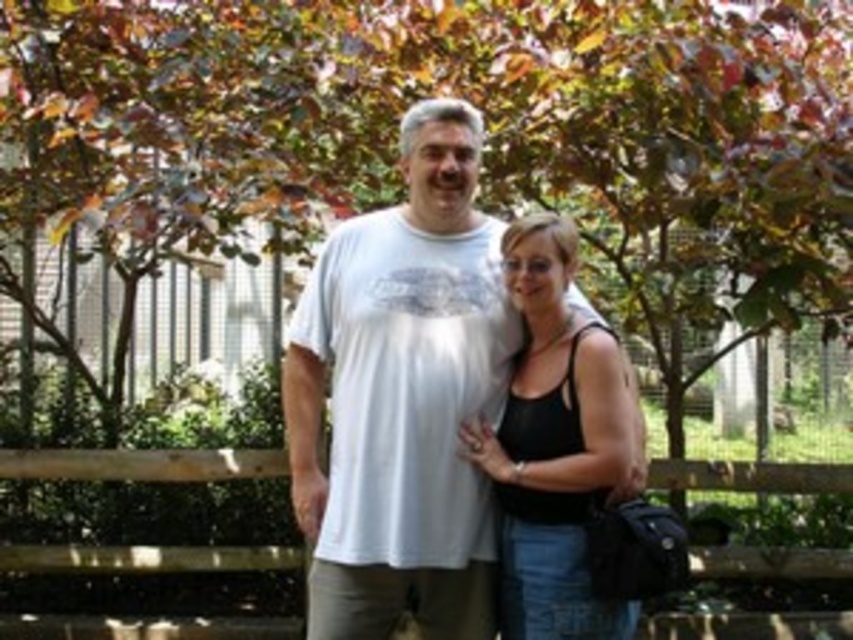
Is white cotton t-shirt at center taller than black matte tank top at center?

Indeed, white cotton t-shirt at center has a greater height compared to black matte tank top at center.

Who is positioned more to the left, white cotton t-shirt at center or black matte tank top at center?

white cotton t-shirt at center

This screenshot has width=853, height=640. What do you see at coordinates (402, 396) in the screenshot? I see `white cotton t-shirt at center` at bounding box center [402, 396].

Identify the location of white cotton t-shirt at center. The width and height of the screenshot is (853, 640). (402, 396).